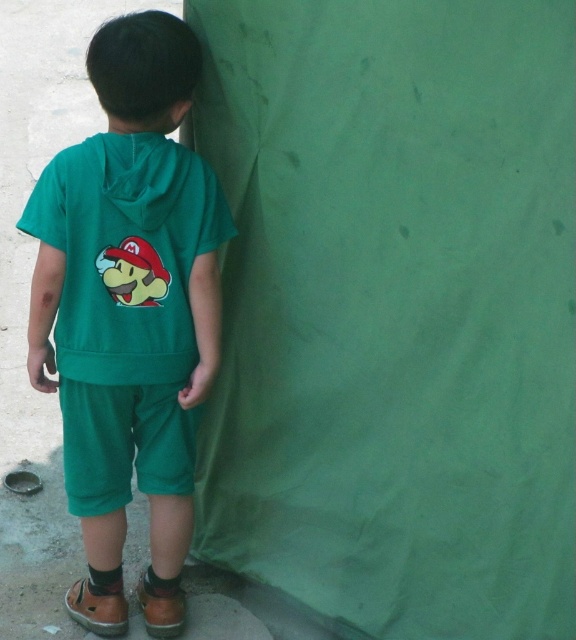
Question: Does matte green hoodie at center have a larger size compared to green cotton shorts at lower center?

Choices:
 (A) no
 (B) yes

Answer: (B)

Question: Which object appears farthest from the camera in this image?

Choices:
 (A) matte green hoodie at center
 (B) green cotton shorts at lower center

Answer: (B)

Question: Is matte green hoodie at center behind green cotton shorts at lower center?

Choices:
 (A) no
 (B) yes

Answer: (A)

Question: Is matte green hoodie at center wider than green cotton shorts at lower center?

Choices:
 (A) no
 (B) yes

Answer: (B)